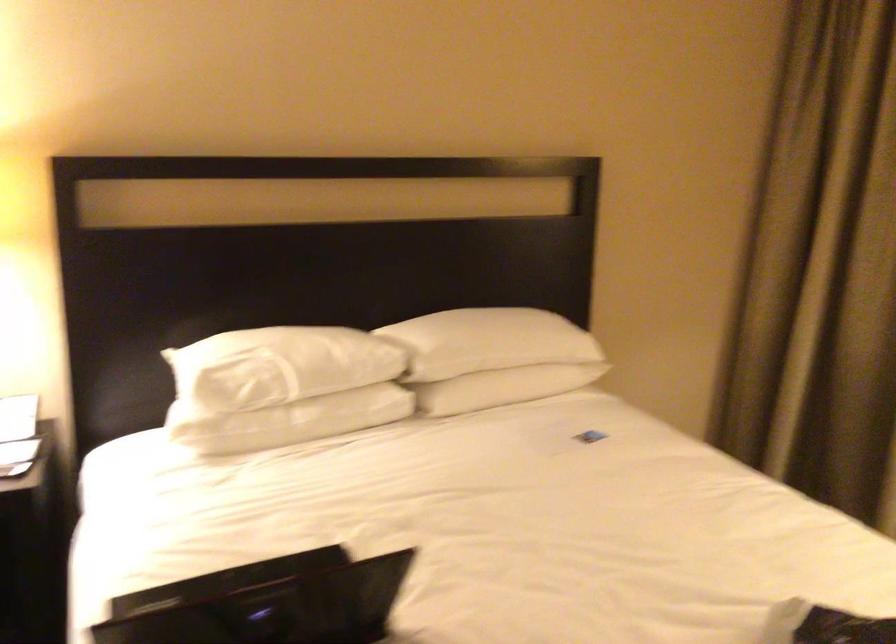
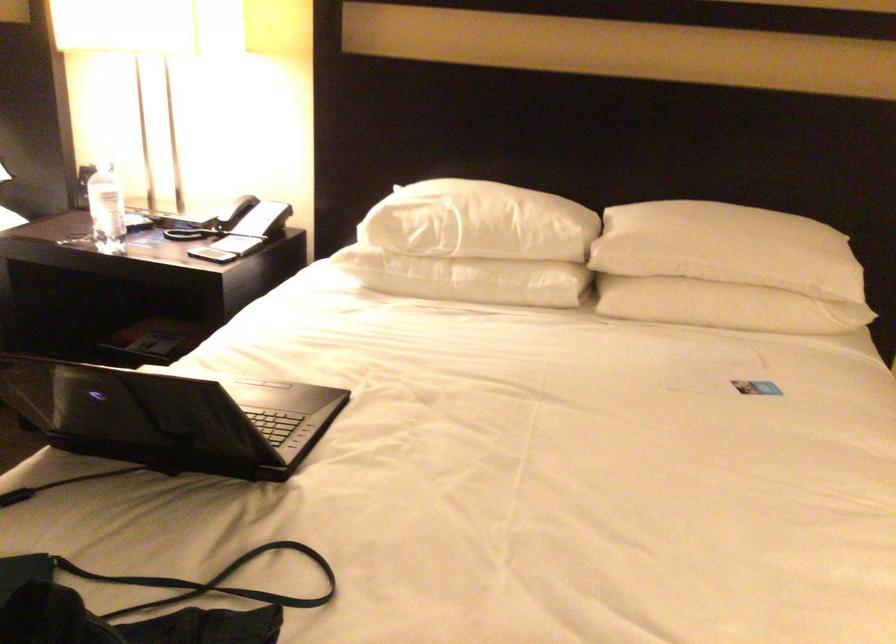
Find the pixel in the second image that matches the point at 513,360 in the first image.

(727, 269)